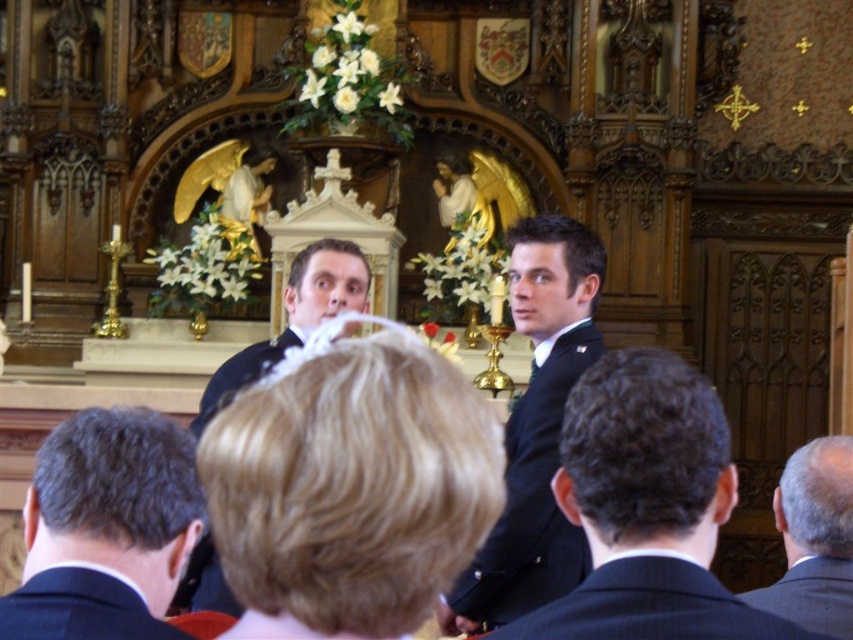
Question: Among these objects, which one is nearest to the camera?

Choices:
 (A) dark blue uniform at center
 (B) dark blue suit at center
 (C) matte black suit at center
 (D) dark brown suit at lower right

Answer: (B)

Question: Which point is closer to the camera?

Choices:
 (A) dark blue suit at center
 (B) matte black suit at center
 (C) dark brown hair at lower left

Answer: (C)

Question: Which point is farther to the camera?

Choices:
 (A) (300, 305)
 (B) (514, 625)
 (C) (71, 436)
 (D) (793, 538)

Answer: (A)

Question: Can you confirm if dark blue uniform at center is thinner than dark brown suit at lower right?

Choices:
 (A) no
 (B) yes

Answer: (B)

Question: Can you confirm if dark blue suit at center is thinner than dark brown suit at lower right?

Choices:
 (A) no
 (B) yes

Answer: (A)

Question: Is dark blue suit at center wider than dark brown suit at lower right?

Choices:
 (A) no
 (B) yes

Answer: (B)